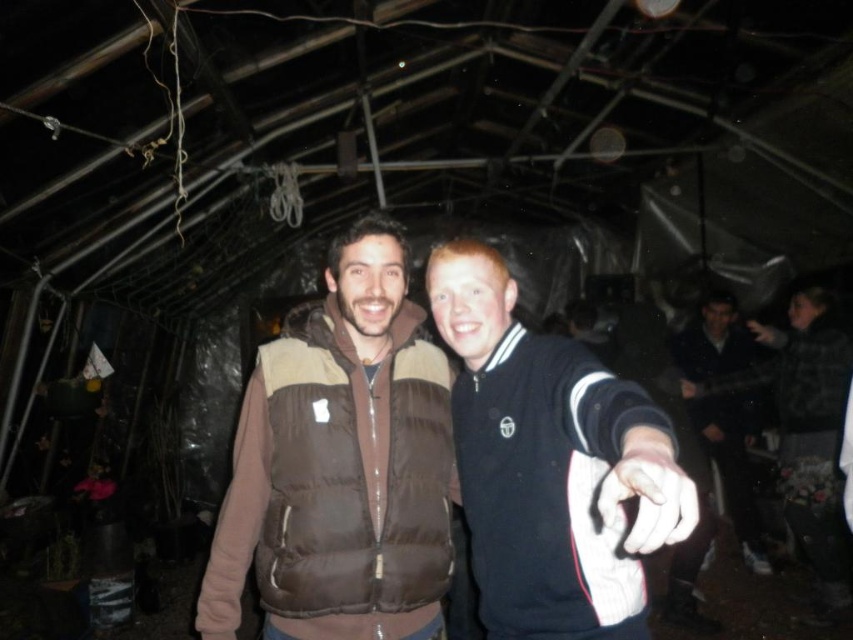
In the scene shown: Who is positioned more to the left, brown puffy vest at center or white matte hand at center?

Positioned to the left is brown puffy vest at center.

Does brown puffy vest at center have a greater width compared to white matte hand at center?

Indeed, brown puffy vest at center has a greater width compared to white matte hand at center.

I want to click on brown puffy vest at center, so click(x=341, y=465).

Can you confirm if brown puffy vest at center is positioned to the left of black matte jacket at right?

Correct, you'll find brown puffy vest at center to the left of black matte jacket at right.

Is brown puffy vest at center to the right of black matte jacket at right from the viewer's perspective?

No, brown puffy vest at center is not to the right of black matte jacket at right.

Which is behind, point (358, 291) or point (723, 298)?

The point (723, 298) is behind.

Where is `brown puffy vest at center`? brown puffy vest at center is located at coordinates (341, 465).

Can you confirm if black matte jacket at right is bigger than matte black hand at upper right?

Yes.

Based on the photo, who is positioned more to the left, black matte jacket at right or matte black hand at upper right?

black matte jacket at right

The height and width of the screenshot is (640, 853). In order to click on black matte jacket at right in this screenshot , I will do `click(733, 465)`.